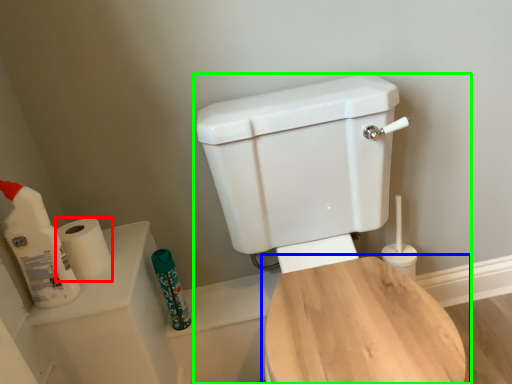
Question: Based on their relative distances, which object is farther from toilet paper (highlighted by a red box)? Choose from toilet (highlighted by a blue box) and toilet (highlighted by a green box).

Choices:
 (A) toilet
 (B) toilet

Answer: (A)